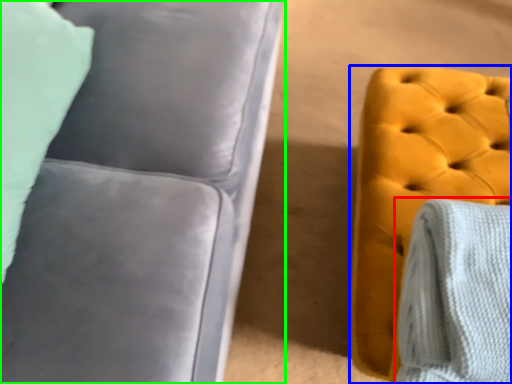
Question: Which is farther away from blanket (highlighted by a red box)? furniture (highlighted by a blue box) or studio couch (highlighted by a green box)?

Choices:
 (A) furniture
 (B) studio couch

Answer: (B)